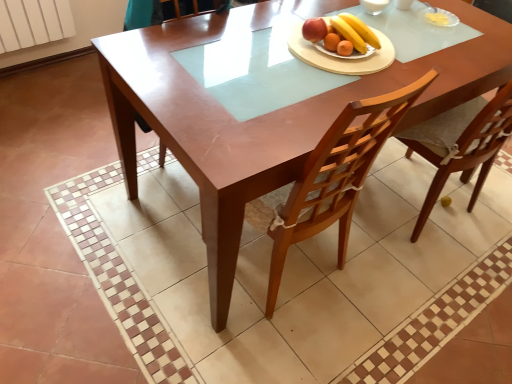
Identify the location of free point in front of shiny white plate with fruits at center. This screenshot has height=384, width=512. click(x=339, y=76).